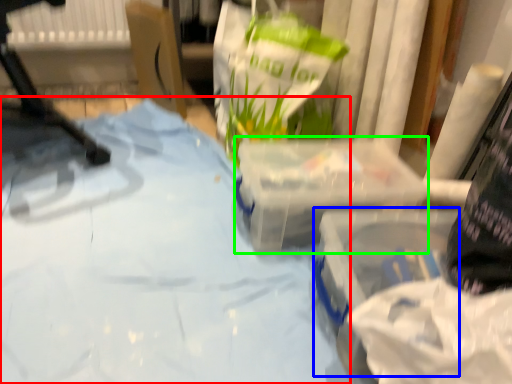
Question: Which object is the farthest from sheet (highlighted by a red box)? Choose among these: box (highlighted by a blue box) or box (highlighted by a green box).

Choices:
 (A) box
 (B) box

Answer: (A)